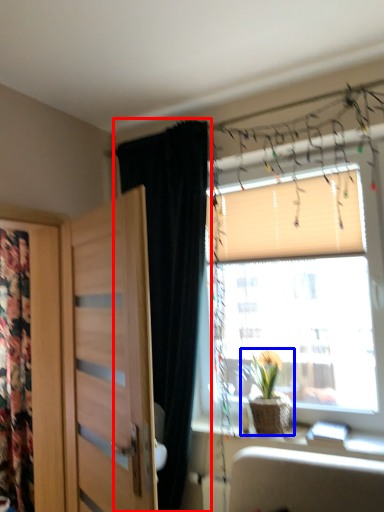
Question: Among these objects, which one is farthest to the camera, curtain (highlighted by a red box) or houseplant (highlighted by a blue box)?

Choices:
 (A) curtain
 (B) houseplant

Answer: (B)